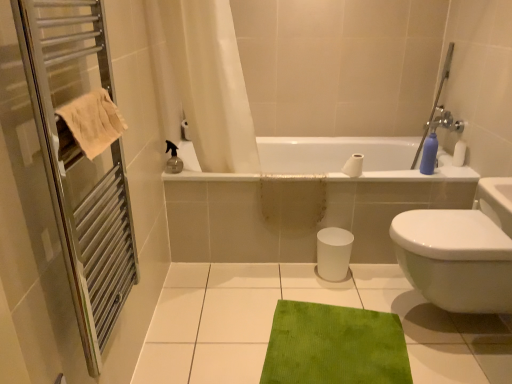
Question: Is green textured mat at lower center smaller than white glossy bathtub at center?

Choices:
 (A) no
 (B) yes

Answer: (B)

Question: Considering the relative positions of green textured mat at lower center and white glossy bathtub at center in the image provided, is green textured mat at lower center in front of white glossy bathtub at center?

Choices:
 (A) no
 (B) yes

Answer: (B)

Question: Does green textured mat at lower center have a greater height compared to white glossy bathtub at center?

Choices:
 (A) no
 (B) yes

Answer: (A)

Question: From the image's perspective, is green textured mat at lower center below white glossy bathtub at center?

Choices:
 (A) no
 (B) yes

Answer: (B)

Question: Is green textured mat at lower center positioned beyond the bounds of white glossy bathtub at center?

Choices:
 (A) no
 (B) yes

Answer: (B)

Question: Considering the positions of beige cotton towel at left and metal towel rack at left in the image, is beige cotton towel at left taller or shorter than metal towel rack at left?

Choices:
 (A) tall
 (B) short

Answer: (B)

Question: Is beige cotton towel at left inside the boundaries of metal towel rack at left, or outside?

Choices:
 (A) inside
 (B) outside

Answer: (A)

Question: Relative to metal towel rack at left, is beige cotton towel at left in front or behind?

Choices:
 (A) behind
 (B) front

Answer: (A)

Question: Looking at the image, does beige cotton towel at left seem bigger or smaller compared to metal towel rack at left?

Choices:
 (A) big
 (B) small

Answer: (B)

Question: Considering the positions of beige cotton towel at left and white fabric shower curtain at upper center in the image, is beige cotton towel at left taller or shorter than white fabric shower curtain at upper center?

Choices:
 (A) short
 (B) tall

Answer: (A)

Question: Relative to white fabric shower curtain at upper center, is beige cotton towel at left in front or behind?

Choices:
 (A) front
 (B) behind

Answer: (A)

Question: From the image's perspective, is beige cotton towel at left positioned above or below white fabric shower curtain at upper center?

Choices:
 (A) below
 (B) above

Answer: (A)

Question: In terms of width, does beige cotton towel at left look wider or thinner when compared to white fabric shower curtain at upper center?

Choices:
 (A) thin
 (B) wide

Answer: (A)

Question: Is blue matte bottle at upper right taller or shorter than green textured mat at lower center?

Choices:
 (A) short
 (B) tall

Answer: (B)

Question: Visually, is blue matte bottle at upper right positioned to the left or to the right of green textured mat at lower center?

Choices:
 (A) right
 (B) left

Answer: (A)